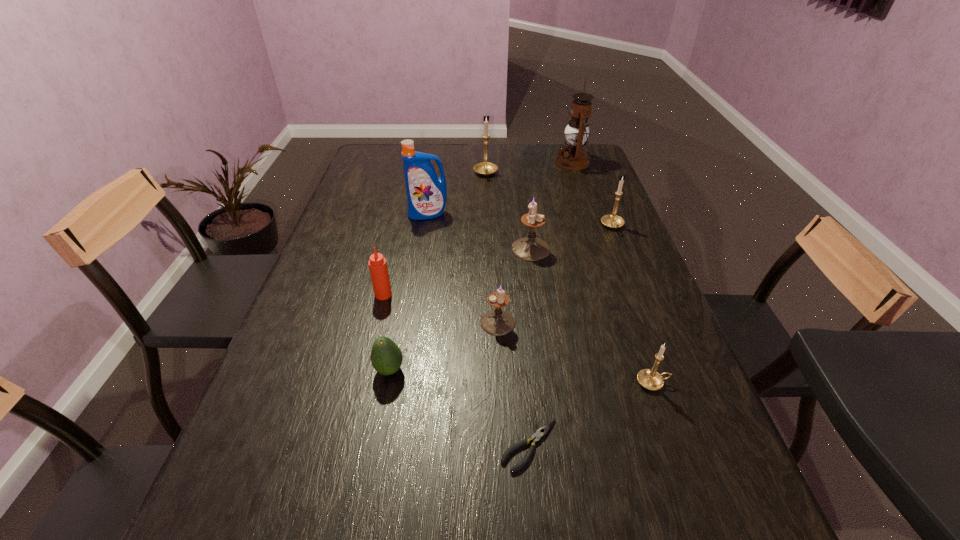
The height and width of the screenshot is (540, 960). Identify the location of vacant space located 0.120m on the side of the tallest object, there is a wick adjustment knob. (524, 163).

In order to click on free space located 0.230m on the label of the ninth shortest object in this screenshot , I will do `click(420, 267)`.

Find the location of a particular element. The width and height of the screenshot is (960, 540). vacant region located on the handle side of the leftmost gold candle holder is located at coordinates (487, 214).

Locate an element on the screen. The height and width of the screenshot is (540, 960). free space located 0.170m on the left of the bigger purple candle holder is located at coordinates (453, 249).

The image size is (960, 540). Identify the location of vacant space situated on the handle side of the second nearest gold candle holder. (622, 249).

I want to click on vacant space located 0.290m on the right of the Tabasco sauce, so click(x=505, y=294).

Locate an element on the screen. free space located 0.140m on the right of the left purple candle holder is located at coordinates (574, 322).

Locate an element on the screen. This screenshot has width=960, height=540. free space located on the back of the green avocado is located at coordinates (409, 266).

At what (x,y) coordinates should I click in order to perform the action: click on vacant space located 0.090m on the left of the pliers. Please return your answer as a coordinate pair (x, y). The image size is (960, 540). Looking at the image, I should click on (451, 446).

This screenshot has height=540, width=960. In order to click on lantern positioned at the far edge in this screenshot , I will do `click(573, 157)`.